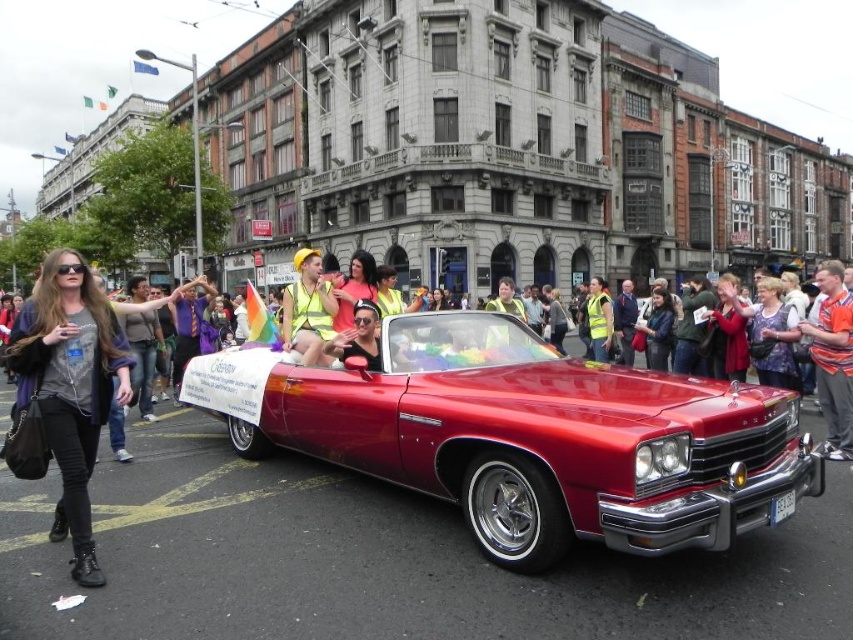
You are a photographer standing on the sidewalk during the parade. You want to take a photo of the shiny red car at center without any people blocking it. Can you do this if the orange shirt at center is currently in front of the car?

The shiny red car at center is positioned under orange shirt at center, meaning the orange shirt is blocking the view of the car. Therefore, you cannot take a clear photo of the shiny red car at center without the orange shirt at center blocking it.

You are a photographer positioned at the side of the street during the parade. You want to take a photo of the shiny red car at center and the black leather jacket at left. From your current position, which object is closer to you?

The shiny red car at center is closer to you because it is in front of the black leather jacket at left.